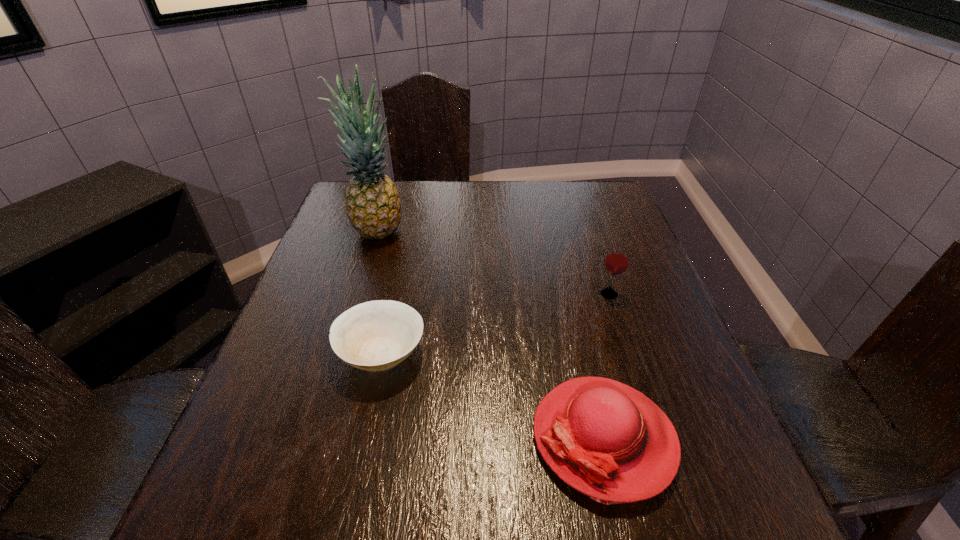
This screenshot has width=960, height=540. I want to click on vacant space located 0.130m at the front of the hat with a bow, so click(456, 437).

I want to click on free space located on the back of the bowl, so click(x=409, y=225).

This screenshot has height=540, width=960. In order to click on object that is at the far edge in this screenshot , I will do `click(373, 206)`.

Where is `object present at the near edge`? The height and width of the screenshot is (540, 960). object present at the near edge is located at coordinates (607, 440).

Locate an element on the screen. Image resolution: width=960 pixels, height=540 pixels. pineapple at the left edge is located at coordinates (373, 206).

This screenshot has height=540, width=960. Find the location of `bowl located in the left edge section of the desktop`. bowl located in the left edge section of the desktop is located at coordinates (377, 335).

At what (x,y) coordinates should I click in order to perform the action: click on glass that is at the right edge. Please return your answer as a coordinate pair (x, y). This screenshot has height=540, width=960. Looking at the image, I should click on (617, 260).

Find the location of a particular element. hat present at the right edge is located at coordinates (607, 440).

You are a GUI agent. You are given a task and a screenshot of the screen. Output one action in this format:
    pyautogui.click(x=<x>, y=<y>)
    Task: Click on the object located at the far left corner
    
    Given the screenshot: What is the action you would take?
    pyautogui.click(x=373, y=206)

Where is `object that is at the near right corner`? The width and height of the screenshot is (960, 540). object that is at the near right corner is located at coordinates (607, 440).